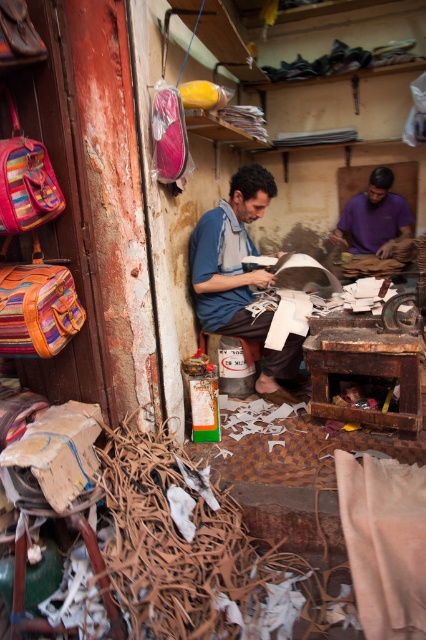
Question: Which point appears farthest from the camera in this image?

Choices:
 (A) (351, 196)
 (B) (17, 170)

Answer: (A)

Question: Which point is closer to the camera taking this photo?

Choices:
 (A) click(x=28, y=164)
 (B) click(x=189, y=252)

Answer: (A)

Question: Does striped fabric backpack at left have a lesser width compared to purple fabric at center?

Choices:
 (A) no
 (B) yes

Answer: (B)

Question: Does striped fabric backpack at left have a smaller size compared to purple fabric at center?

Choices:
 (A) yes
 (B) no

Answer: (A)

Question: Does blue fabric shirt at center appear under striped fabric backpack at left?

Choices:
 (A) no
 (B) yes

Answer: (B)

Question: Based on their relative distances, which object is farther from the blue fabric shirt at center?

Choices:
 (A) striped fabric backpack at left
 (B) purple fabric at center

Answer: (B)